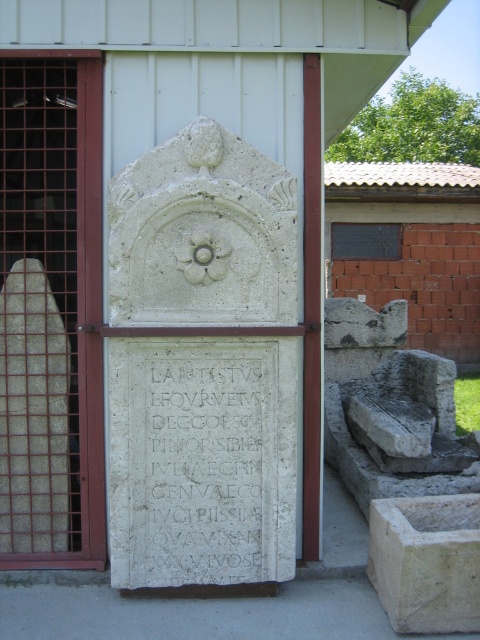
Does white stone inscription at center have a lesser width compared to white stone basin at lower right?

Incorrect, white stone inscription at center's width is not less than white stone basin at lower right's.

Can you confirm if white stone inscription at center is positioned below white stone basin at lower right?

Actually, white stone inscription at center is above white stone basin at lower right.

Between point (181, 512) and point (404, 621), which one is positioned behind?

Point (181, 512)

I want to click on white stone inscription at center, so click(x=203, y=468).

Describe the element at coordinates (202, 364) in the screenshot. The height and width of the screenshot is (640, 480). I see `white stone plaque at center` at that location.

Does white stone plaque at center lie in front of white stone inscription at center?

Yes, white stone plaque at center is closer to the viewer.

The width and height of the screenshot is (480, 640). What do you see at coordinates (202, 364) in the screenshot?
I see `white stone plaque at center` at bounding box center [202, 364].

This screenshot has width=480, height=640. I want to click on white stone plaque at center, so click(x=202, y=364).

Can you confirm if white stone plaque at center is wider than white stone basin at lower right?

Yes.

Is point (294, 440) in front of point (479, 616)?

No, (294, 440) is behind (479, 616).

Who is more distant from viewer, [147,422] or [419,588]?

The point [147,422] is behind.

In order to click on white stone plaque at center in this screenshot , I will do `click(202, 364)`.